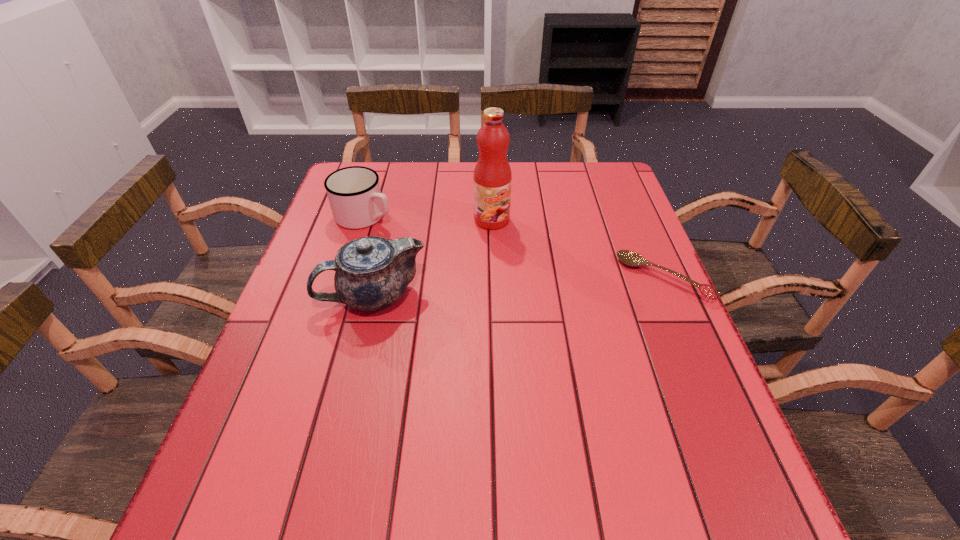
At what (x,y) coordinates should I click in order to perform the action: click on the third shortest object. Please return your answer as a coordinate pair (x, y). This screenshot has width=960, height=540. Looking at the image, I should click on [x=371, y=273].

Identify the location of the shortest object. This screenshot has height=540, width=960. (630, 258).

This screenshot has height=540, width=960. In order to click on the rightmost object in this screenshot , I will do `click(630, 258)`.

Locate an element on the screen. the second shortest object is located at coordinates (354, 194).

Identify the location of the third object from left to right. The image size is (960, 540). (492, 178).

The image size is (960, 540). Identify the location of fruit juice. (492, 178).

You are a GUI agent. You are given a task and a screenshot of the screen. Output one action in this format:
    pyautogui.click(x=<x>, y=<y>)
    Task: Click on the free location located from the spout of the second tallest object
    
    Given the screenshot: What is the action you would take?
    pyautogui.click(x=289, y=295)

Locate an element on the screen. vacant space located on the front of the rightmost object is located at coordinates (688, 336).

I want to click on free location located on the side of the mug with the handle, so click(411, 233).

This screenshot has height=540, width=960. I want to click on vacant space situated on the side of the mug with the handle, so tap(466, 256).